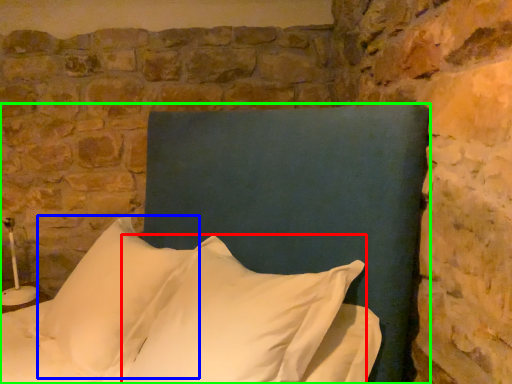
Question: Estimate the real-world distances between objects in this image. Which object is closer to pillow (highlighted by a red box), pillow (highlighted by a blue box) or bed (highlighted by a green box)?

Choices:
 (A) pillow
 (B) bed

Answer: (B)